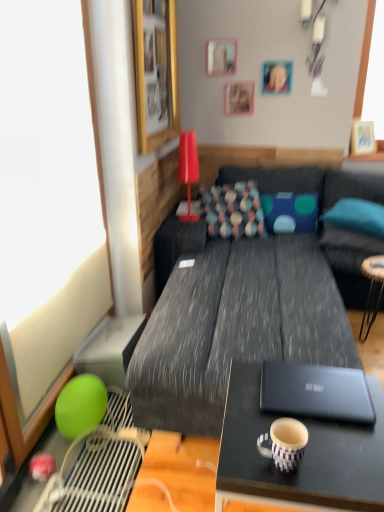
You are a GUI agent. You are given a task and a screenshot of the screen. Output one action in this format:
    pyautogui.click(x=<x>, y=<y>)
    Task: Click on the vacant area located to the right-hand side of porcelain textured mug at center
    
    Given the screenshot: What is the action you would take?
    pyautogui.click(x=339, y=456)